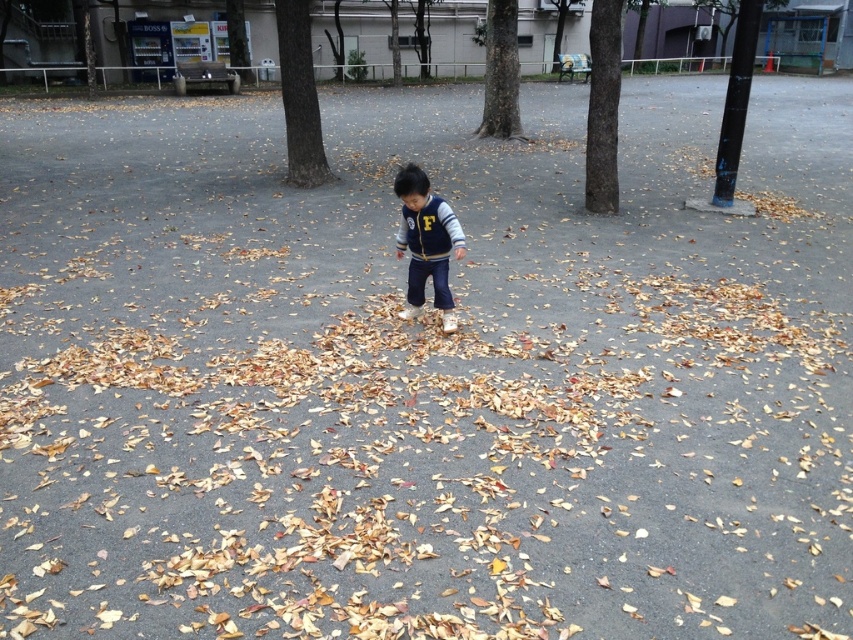
You are a park visitor who wants to find the wider tree between the brown rough bark tree at upper center and the smooth bark tree at center. Which one should you choose?

The smooth bark tree at center is wider than the brown rough bark tree at upper center, so you should choose the smooth bark tree at center.

You are standing at the center of the park and see the navy blue fleece jacket at center and the brown rough bark tree at upper center. If you want to reach the tree first, which direction should you walk?

To reach the brown rough bark tree at upper center first, you should walk towards the upper center direction since the tree is located there and the navy blue fleece jacket at center is closer to your current position.

You are standing at the point labeled point (320,145) and want to walk to the point labeled point (456,221). Which direction should you face to move towards your destination?

You should face forward because point (456,221) is in front of point (320,145).